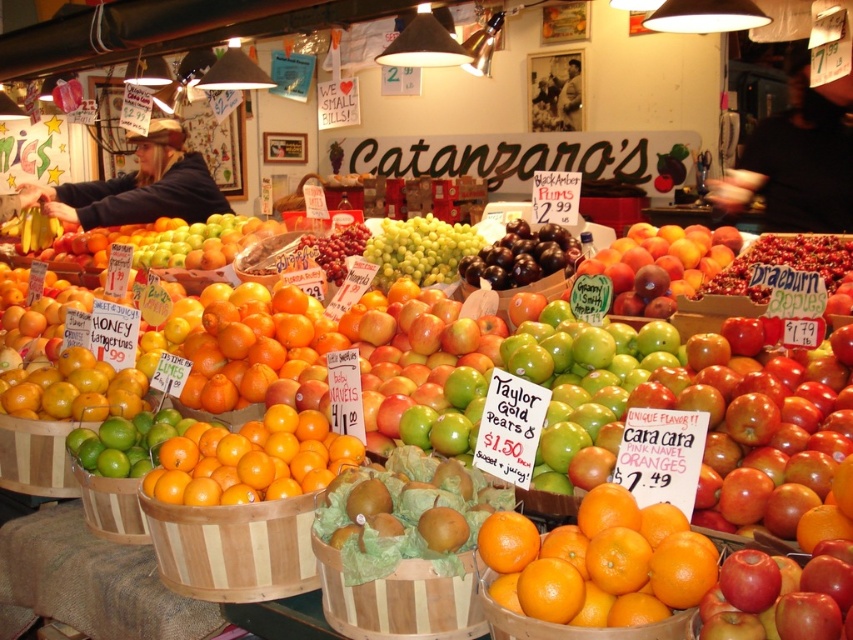
Question: Estimate the real-world distances between objects in this image. Which object is closer to the shiny dark purple grapes at center?

Choices:
 (A) shiny orange oranges at center
 (B) green matte grapes at center
 (C) orangesmoothorange at center
 (D) green matte granny smith apples at center

Answer: (D)

Question: Is red matte apple at lower right thinner than green matte granny smith apples at center?

Choices:
 (A) no
 (B) yes

Answer: (B)

Question: Which point is farther to the camera?

Choices:
 (A) (389, 282)
 (B) (791, 627)
 (C) (573, 264)
 (D) (538, 616)

Answer: (A)

Question: Can you confirm if orange matte/orange at center is positioned to the right of shiny dark purple grapes at center?

Choices:
 (A) yes
 (B) no

Answer: (B)

Question: Can you confirm if shiny orange oranges at center is positioned above green matte granny smith apples at center?

Choices:
 (A) yes
 (B) no

Answer: (B)

Question: Which object is closer to the camera taking this photo?

Choices:
 (A) red matte apple at lower right
 (B) orange matte/orange at center
 (C) shiny orange oranges at center
 (D) orangesmoothorange at right

Answer: (A)